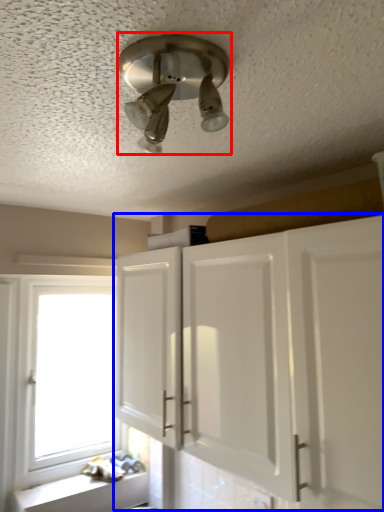
Question: Which object appears farthest to the camera in this image, light fixture (highlighted by a red box) or cabinetry (highlighted by a blue box)?

Choices:
 (A) light fixture
 (B) cabinetry

Answer: (B)